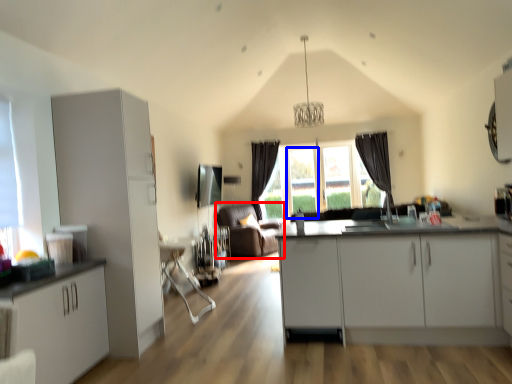
Question: Which of the following is the farthest to the observer, couch (highlighted by a red box) or glass door (highlighted by a blue box)?

Choices:
 (A) couch
 (B) glass door

Answer: (B)